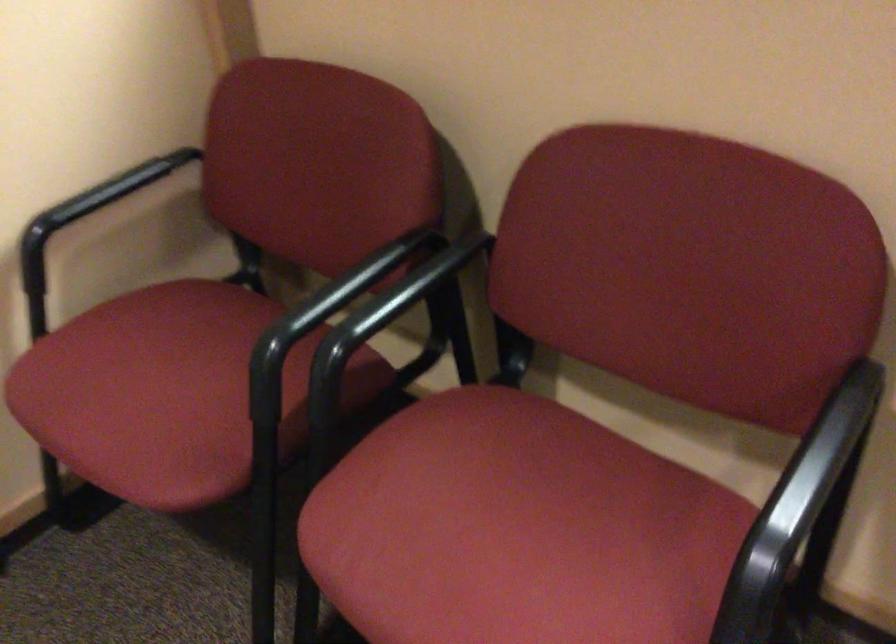
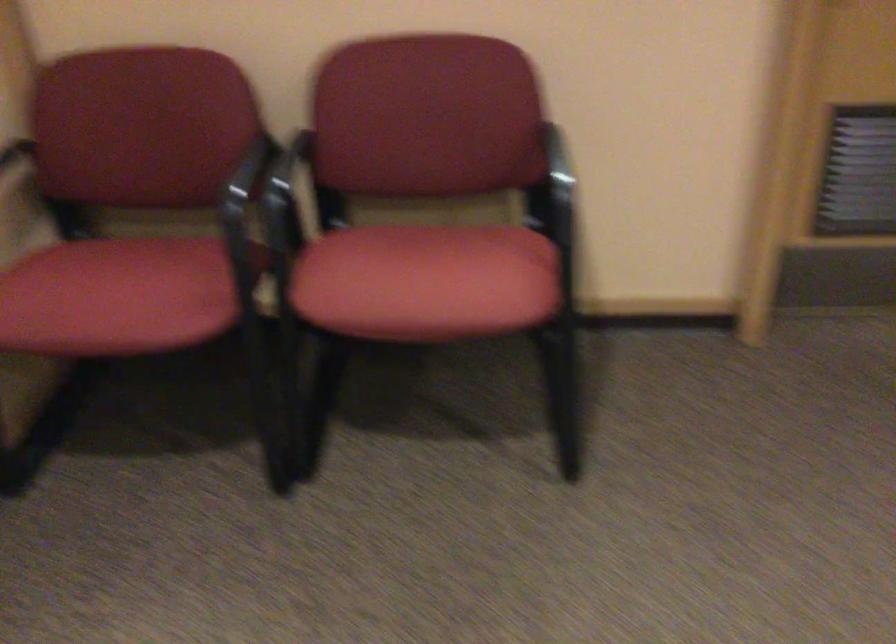
Locate, in the second image, the point that corresponds to pixel 332 361 in the first image.

(286, 204)